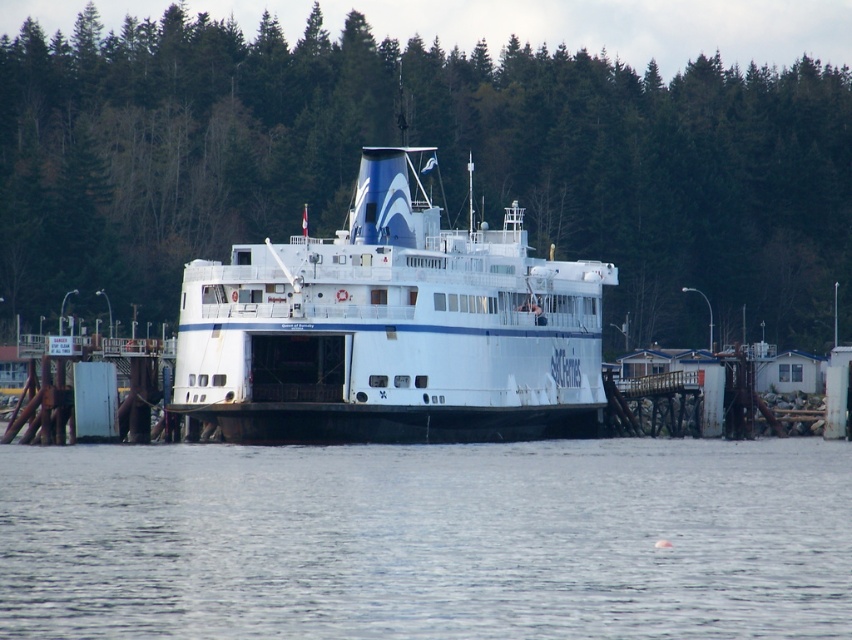
Is green leafy trees at upper center shorter than clear water at center?

In fact, green leafy trees at upper center may be taller than clear water at center.

Describe the element at coordinates (436, 161) in the screenshot. The width and height of the screenshot is (852, 640). I see `green leafy trees at upper center` at that location.

The image size is (852, 640). What do you see at coordinates (436, 161) in the screenshot?
I see `green leafy trees at upper center` at bounding box center [436, 161].

At what (x,y) coordinates should I click in order to perform the action: click on green leafy trees at upper center. Please return your answer as a coordinate pair (x, y). The image size is (852, 640). Looking at the image, I should click on (436, 161).

Which of these two, clear water at center or white matte ferry at center, stands taller?

white matte ferry at center is taller.

Who is higher up, clear water at center or white matte ferry at center?

white matte ferry at center

The height and width of the screenshot is (640, 852). In order to click on clear water at center in this screenshot , I will do `click(427, 540)`.

Which is more to the left, green leafy trees at upper center or white matte ferry at center?

white matte ferry at center is more to the left.

The image size is (852, 640). Describe the element at coordinates (436, 161) in the screenshot. I see `green leafy trees at upper center` at that location.

Does point (181, 81) lie behind point (447, 291)?

Yes, it is.

You are a GUI agent. You are given a task and a screenshot of the screen. Output one action in this format:
    pyautogui.click(x=<x>, y=<y>)
    Task: Click on the green leafy trees at upper center
    The width and height of the screenshot is (852, 640).
    Given the screenshot: What is the action you would take?
    pyautogui.click(x=436, y=161)